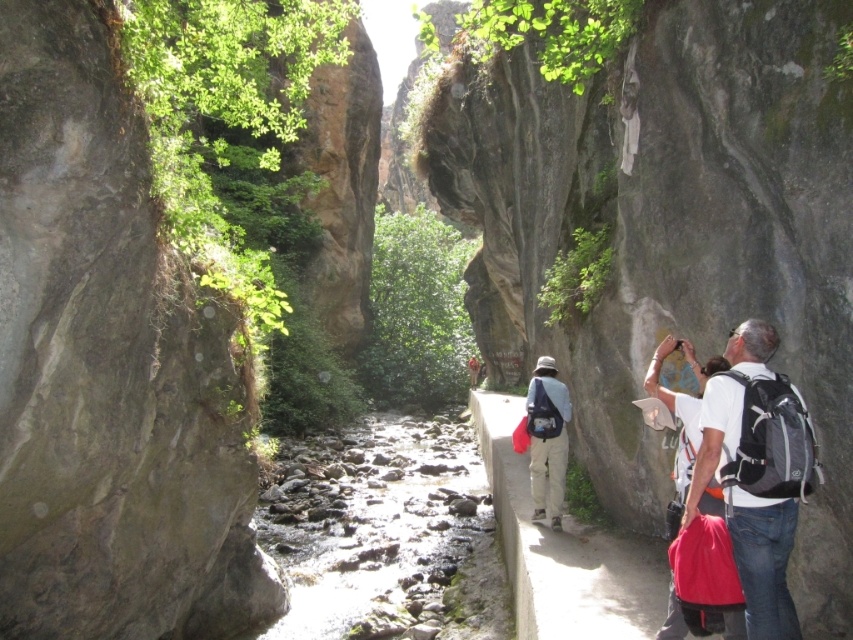
Question: Which point is farther to the camera?

Choices:
 (A) khaki fabric pants at center
 (B) white fabric backpack at right

Answer: (A)

Question: Which point is closer to the camera?

Choices:
 (A) khaki fabric pants at center
 (B) white fabric backpack at right

Answer: (B)

Question: Among these points, which one is farthest from the camera?

Choices:
 (A) (556, 420)
 (B) (734, 412)

Answer: (A)

Question: Is white fabric backpack at right bigger than khaki fabric pants at center?

Choices:
 (A) yes
 (B) no

Answer: (A)

Question: Can you confirm if white fabric backpack at right is positioned below khaki fabric pants at center?

Choices:
 (A) no
 (B) yes

Answer: (A)

Question: From the image, what is the correct spatial relationship of white fabric backpack at right in relation to khaki fabric pants at center?

Choices:
 (A) right
 (B) left

Answer: (A)